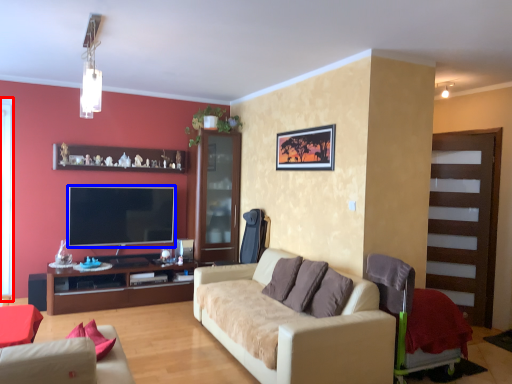
Question: Which object appears closest to the camera in this image, window screen (highlighted by a red box) or television (highlighted by a blue box)?

Choices:
 (A) window screen
 (B) television

Answer: (A)